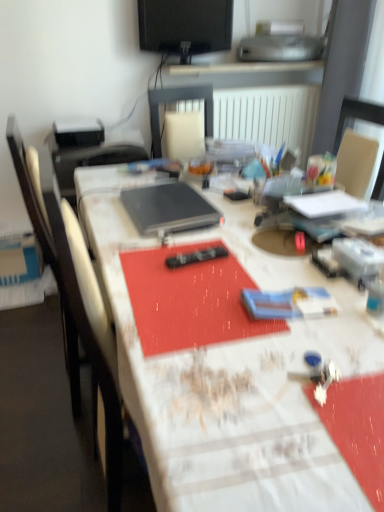
This screenshot has height=512, width=384. Identify the location of vacant space to the right of black matte laptop at center. (242, 217).